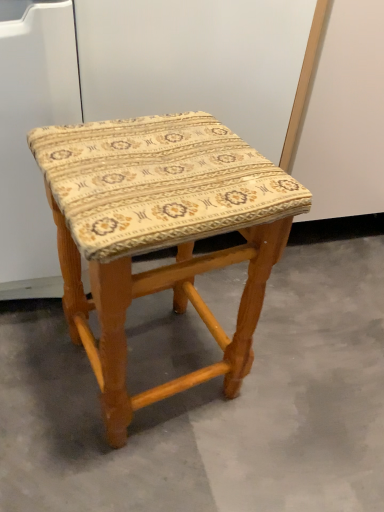
Find the location of `vacant space to the right of wooden stool at center`. vacant space to the right of wooden stool at center is located at coordinates (300, 384).